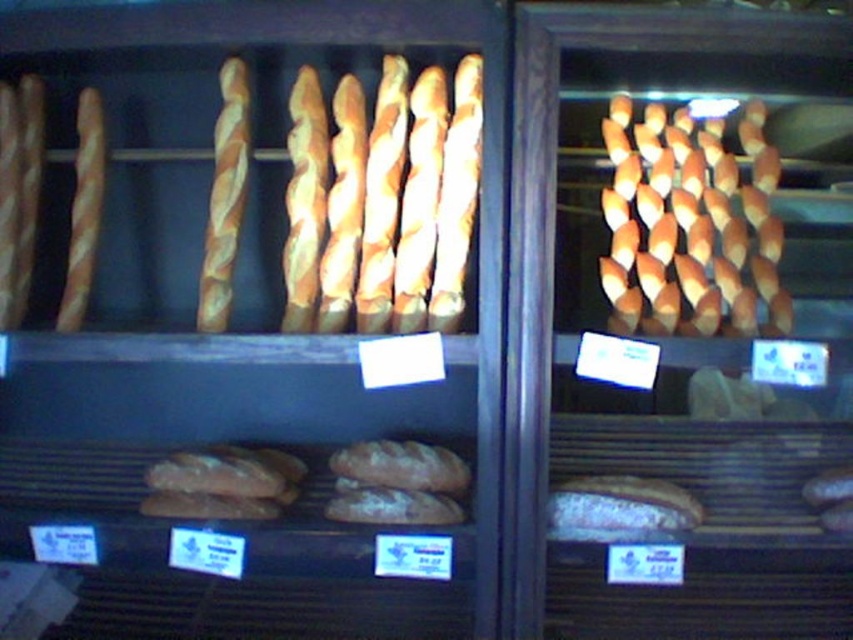
Question: Is golden brown baguette at center below golden brown twisted bread at center?

Choices:
 (A) no
 (B) yes

Answer: (B)

Question: Can you confirm if golden brown baguette at center is wider than golden brown twisted bread at center?

Choices:
 (A) yes
 (B) no

Answer: (A)

Question: Which point is farther to the camera?

Choices:
 (A) (631, 150)
 (B) (222, 116)

Answer: (A)

Question: Among these objects, which one is farthest from the camera?

Choices:
 (A) golden brown baguette at center
 (B) golden brown twisted bread at center

Answer: (B)

Question: Which point is closer to the camera?

Choices:
 (A) (238, 176)
 (B) (611, 273)

Answer: (B)

Question: In this image, where is golden brown baguette at center located relative to golden brown twisted bread at center?

Choices:
 (A) below
 (B) above

Answer: (A)